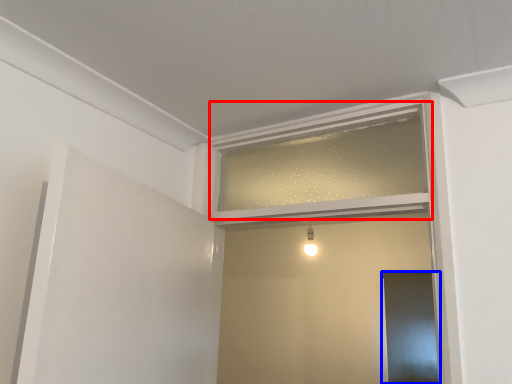
Question: Which of the following is the farthest to the observer, window frame (highlighted by a red box) or screen door (highlighted by a blue box)?

Choices:
 (A) window frame
 (B) screen door

Answer: (B)